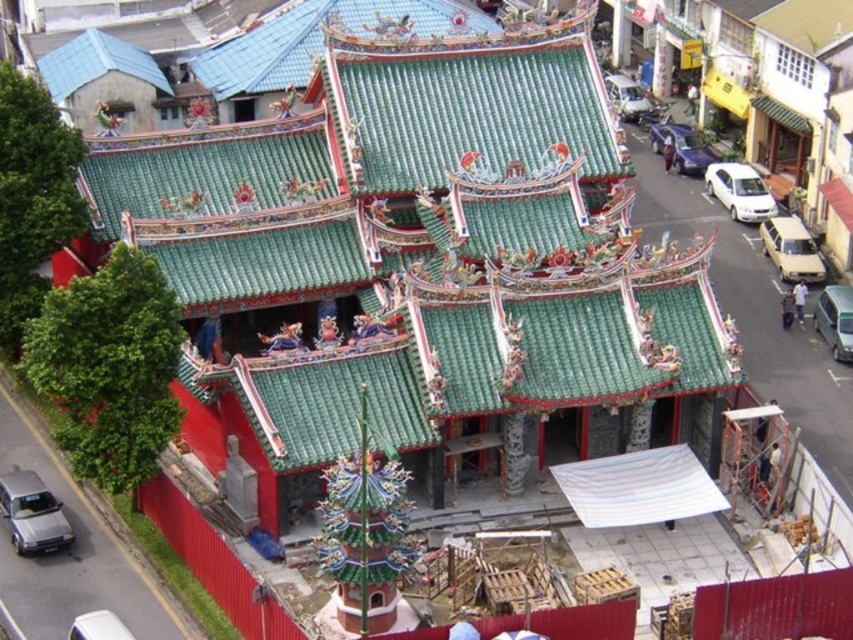
You are standing in front of a traditional Chinese building with a green roof and red walls. You see a point labeled at coordinates (637, 486). What is located at that point?

The point at coordinates (637, 486) indicates a white striped canopy at center.

From the picture: You are standing in front of a traditional Chinese building with a green roof and red walls. There is a pagoda under construction nearby. A point in the scene has coordinates point (695, 513). Can you tell me how far this point is from your current position?

The point (695, 513) is 39.11 meters away from the camera.

You are standing in front of the traditional Chinese building and want to walk from the white plastic car at lower left to the white striped canopy at center. Which direction should you move to get closer to the canopy?

You should move forward because the white striped canopy at center is further to the viewer than the white plastic car at lower left, meaning the canopy is farther away from your current position. Moving forward will bring you closer to it.